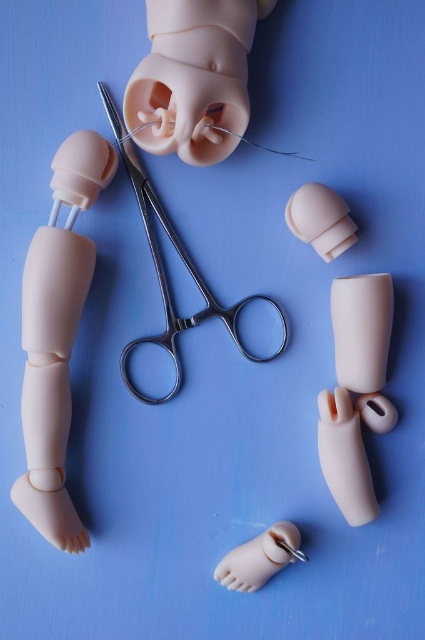
Question: Is matte plastic leg at left smaller than matte plastic foot at lower center?

Choices:
 (A) yes
 (B) no

Answer: (B)

Question: Is matte pink plastic hand at center positioned in front of matte plastic hand at center?

Choices:
 (A) no
 (B) yes

Answer: (B)

Question: Estimate the real-world distances between objects in this image. Which object is farther from the matte pink plastic hand at center?

Choices:
 (A) metallic scissors at center
 (B) matte plastic leg at left
 (C) matte plastic nose at upper center
 (D) matte plastic hand at center

Answer: (B)

Question: Among these objects, which one is nearest to the camera?

Choices:
 (A) metallic scissors at center
 (B) matte plastic hand at center

Answer: (A)

Question: Which object appears farthest from the camera in this image?

Choices:
 (A) metallic scissors at center
 (B) matte plastic leg at left
 (C) matte plastic hand at center

Answer: (C)

Question: Does matte plastic nose at upper center have a greater width compared to matte plastic hand at center?

Choices:
 (A) yes
 (B) no

Answer: (A)